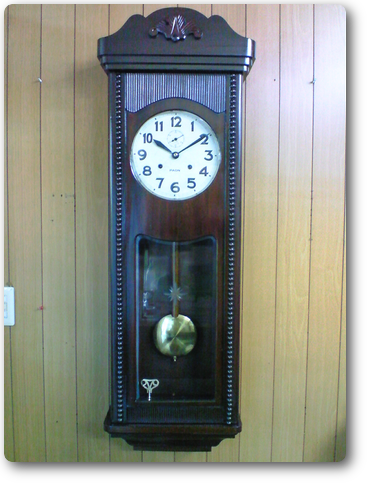
This screenshot has height=483, width=367. What are the coordinates of `clock face` in the screenshot? It's located at (176, 161).